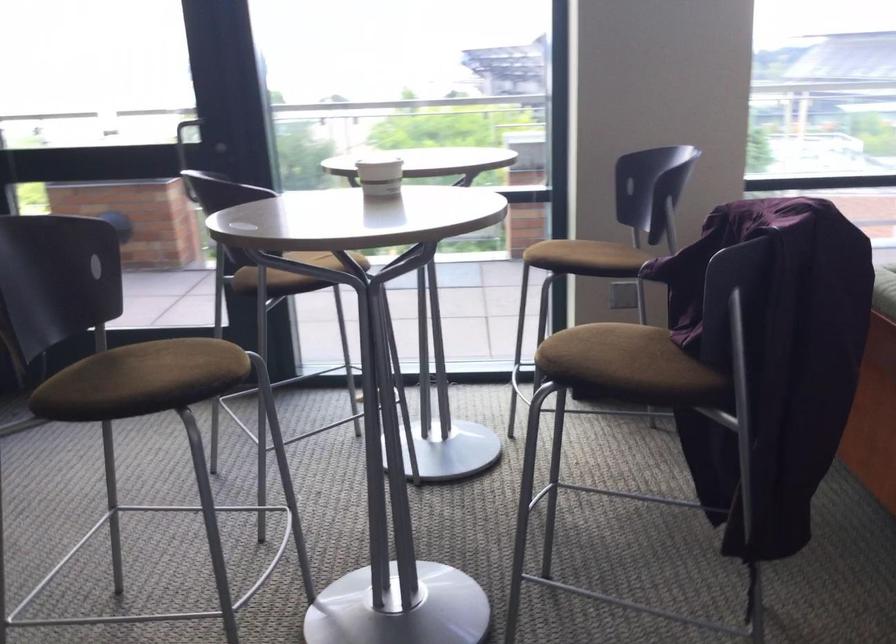
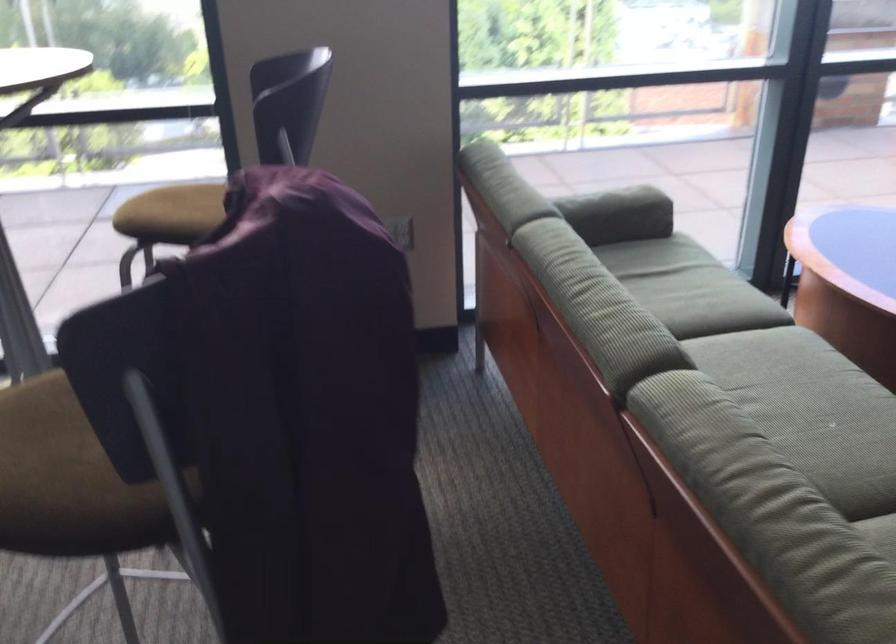
Question: The first image is from the beginning of the video and the second image is from the end. How did the camera likely rotate when shooting the video?

Choices:
 (A) Left
 (B) Right
 (C) Up
 (D) Down

Answer: (B)